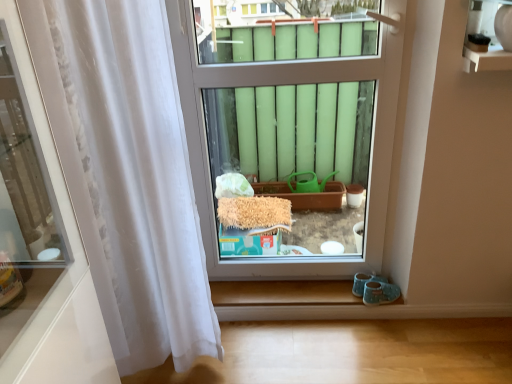
Describe the element at coordinates (291, 129) in the screenshot. I see `transparent glass window at center` at that location.

The image size is (512, 384). I want to click on transparent glass window at center, so click(x=291, y=129).

The height and width of the screenshot is (384, 512). Identify the location of white sheer curtain at left. (127, 173).

Image resolution: width=512 pixels, height=384 pixels. Describe the element at coordinates (127, 173) in the screenshot. I see `white sheer curtain at left` at that location.

Image resolution: width=512 pixels, height=384 pixels. I want to click on transparent glass window at center, so [291, 129].

Which is more to the left, transparent glass window at center or white sheer curtain at left?

Positioned to the left is white sheer curtain at left.

Is transparent glass window at center further to the viewer compared to white sheer curtain at left?

Yes, transparent glass window at center is behind white sheer curtain at left.

Does point (242, 72) appear closer or farther from the camera than point (131, 282)?

Clearly, point (242, 72) is more distant from the camera than point (131, 282).

From the image's perspective, between transparent glass window at center and white sheer curtain at left, which one is located above?

From the image's view, transparent glass window at center is above.

From a real-world perspective, is transparent glass window at center over white sheer curtain at left?

Yes.

Is transparent glass window at center wider or thinner than white sheer curtain at left?

Clearly, transparent glass window at center has less width compared to white sheer curtain at left.

Is transparent glass window at center shorter than white sheer curtain at left?

Yes, transparent glass window at center is shorter than white sheer curtain at left.

Considering the relative sizes of transparent glass window at center and white sheer curtain at left in the image provided, is transparent glass window at center smaller than white sheer curtain at left?

Indeed, transparent glass window at center has a smaller size compared to white sheer curtain at left.

Is white sheer curtain at left located within transparent glass window at center?

No, transparent glass window at center does not contain white sheer curtain at left.

Are transparent glass window at center and white sheer curtain at left making contact?

transparent glass window at center and white sheer curtain at left are not in contact.

Could you tell me if transparent glass window at center is facing white sheer curtain at left?

No.

How distant is transparent glass window at center from white sheer curtain at left?

transparent glass window at center is 71.35 centimeters from white sheer curtain at left.

Locate an element on the screen. window lying above the white sheer curtain at left (from the image's perspective) is located at coordinates (291, 129).

Is white sheer curtain at left at the left side of transparent glass window at center?

Correct, you'll find white sheer curtain at left to the left of transparent glass window at center.

Which object is closer to the camera taking this photo, white sheer curtain at left or transparent glass window at center?

white sheer curtain at left.

Does point (109, 315) lie in front of point (333, 47)?

Yes, it is in front of point (333, 47).

From the image's perspective, is white sheer curtain at left over transparent glass window at center?

Incorrect, from the image's perspective, white sheer curtain at left is lower than transparent glass window at center.

From a real-world perspective, who is located higher, white sheer curtain at left or transparent glass window at center?

transparent glass window at center.

Which of these two, white sheer curtain at left or transparent glass window at center, is thinner?

transparent glass window at center is thinner.

Can you confirm if white sheer curtain at left is taller than transparent glass window at center?

Yes, white sheer curtain at left is taller than transparent glass window at center.

Considering the sizes of white sheer curtain at left and transparent glass window at center in the image, is white sheer curtain at left bigger or smaller than transparent glass window at center?

In the image, white sheer curtain at left appears to be larger than transparent glass window at center.

Is white sheer curtain at left not within transparent glass window at center?

Indeed, white sheer curtain at left is completely outside transparent glass window at center.

Is white sheer curtain at left placed right next to transparent glass window at center?

No, white sheer curtain at left is not touching transparent glass window at center.

Could you tell me if white sheer curtain at left is facing transparent glass window at center?

No, white sheer curtain at left does not turn towards transparent glass window at center.

You are a GUI agent. You are given a task and a screenshot of the screen. Output one action in this format:
    pyautogui.click(x=<x>, y=<y>)
    Task: Click on the curtain on the left of transparent glass window at center
    The height and width of the screenshot is (384, 512).
    Given the screenshot: What is the action you would take?
    pyautogui.click(x=127, y=173)

Locate an element on the screen. Image resolution: width=512 pixels, height=384 pixels. curtain on the left of transparent glass window at center is located at coordinates (127, 173).

There is a white sheer curtain at left. What are the coordinates of `window above it (from a real-world perspective)` in the screenshot? It's located at (291, 129).